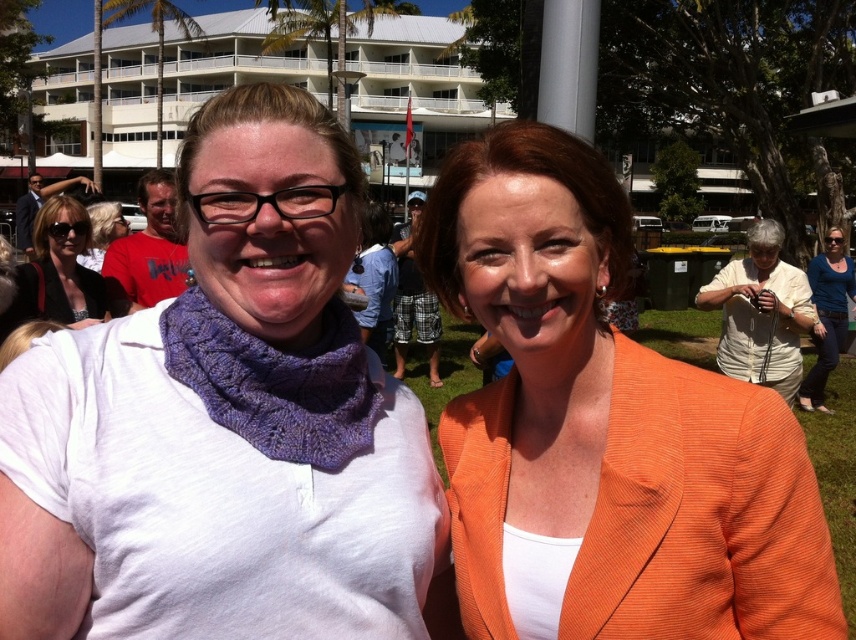
You are a photographer trying to capture a clear shot of both the orange textured blazer at center and the blonde hair at center. Since you want to ensure both are visible, which object should you focus on first to account for their sizes?

The orange textured blazer at center is larger than the blonde hair at center, so you should focus on the orange textured blazer at center first to ensure its details are captured clearly before adjusting for the smaller blonde hair at center.

You are taking a photo of two people in a park. You notice the orange textured blazer at center and the blonde hair at center. Which one should you focus on first if you want to capture them from left to right?

You should focus on the blonde hair at center first because the orange textured blazer at center is to the right of it.